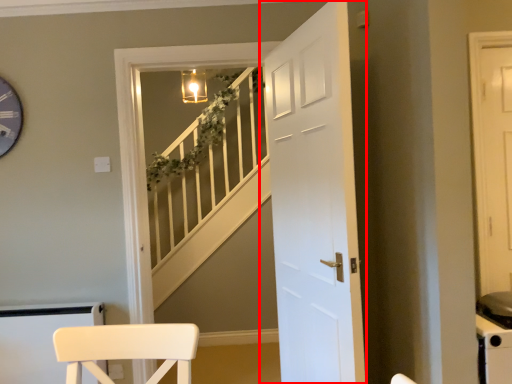
Question: Where is door (annotated by the red box) located in relation to stairwell in the image?

Choices:
 (A) left
 (B) right

Answer: (B)